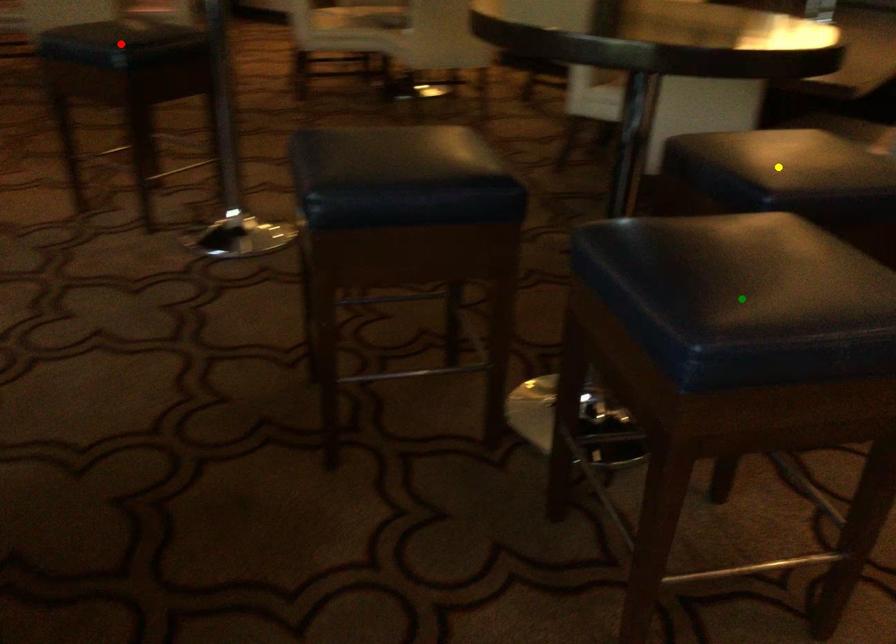
Order these from nearest to farthest:
red point, yellow point, green point

red point, yellow point, green point